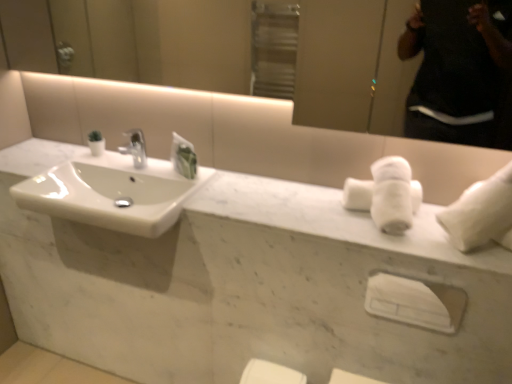
Find the location of a particular element. free space between white fluffy bath towel at upper right, marked as the 2th bath towel in a right-to-left arrangement, and white matte towel at right, the 1th bath towel when ordered from right to left is located at coordinates (401, 235).